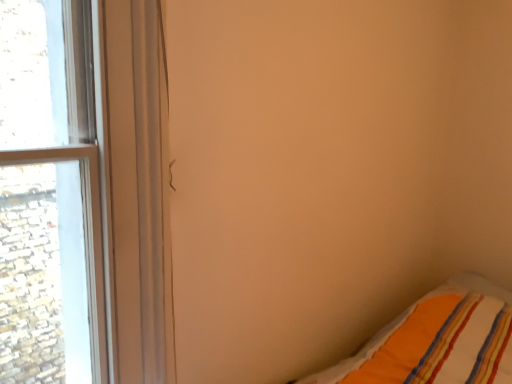
Question: Should I look upward or downward to see clear glass window at left?

Choices:
 (A) down
 (B) up

Answer: (B)